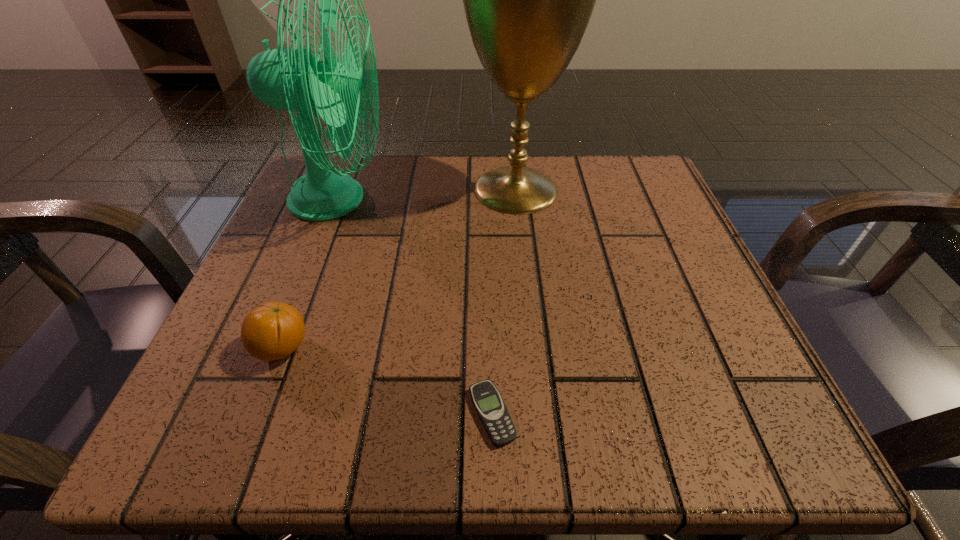
In order to click on trophy cup in this screenshot , I will do `click(528, 0)`.

Find the location of `fan`. fan is located at coordinates [291, 79].

Where is `the second shortest object`? This screenshot has height=540, width=960. the second shortest object is located at coordinates (272, 331).

Find the location of `orange`. orange is located at coordinates (272, 331).

Image resolution: width=960 pixels, height=540 pixels. Identify the location of the nearest object. (489, 405).

What are the coordinates of `the shortest object` in the screenshot? It's located at (489, 405).

What are the coordinates of `vacant space located on the front of the trophy cup` in the screenshot? It's located at (524, 267).

At what (x,y) coordinates should I click in order to perform the action: click on free space located 0.320m in front of the fan to blow air. Please return your answer as a coordinate pair (x, y). This screenshot has width=960, height=540. Looking at the image, I should click on (545, 199).

Locate an element on the screen. free region located 0.400m on the back of the second nearest object is located at coordinates (348, 178).

Image resolution: width=960 pixels, height=540 pixels. I want to click on free point located 0.150m on the left of the nearest object, so click(x=349, y=414).